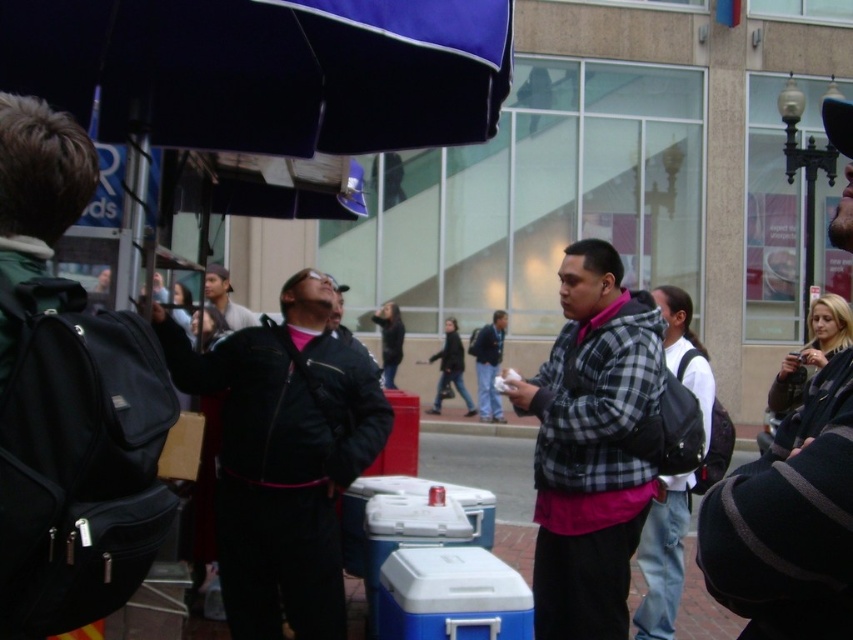
You are standing at the point with coordinates point [415,582] and want to walk towards the point [613,381]. Which direction should you move to get closer to your destination?

You should move forward because point [613,381] is closer to the viewer than point [415,582], so moving forward will bring you closer to it.

You are standing at the center of the scene and want to locate the blue fabric umbrella at upper center. Based on the coordinates provided, in which direction should you look to find it?

The blue fabric umbrella at upper center is located at coordinates point (265, 70), so you should look to the left and slightly downward from the center of the scene to find it.